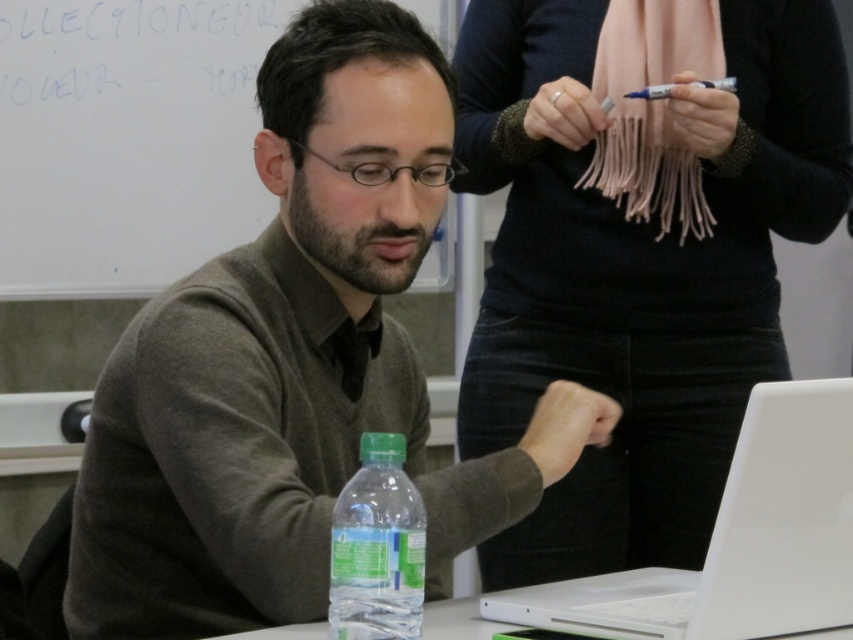
Question: Which of these objects is positioned closest to the matte gray sweater at center?

Choices:
 (A) whiteboard at upper left
 (B) white glossy laptop at lower right
 (C) metallic silver pen at upper right
 (D) pink fabric scarf at upper center

Answer: (B)

Question: Estimate the real-world distances between objects in this image. Which object is farther from the matte gray sweater at center?

Choices:
 (A) metallic silver pen at upper right
 (B) pink fabric scarf at upper center

Answer: (A)

Question: Where is whiteboard at upper left located in relation to white glossy laptop at lower right in the image?

Choices:
 (A) below
 (B) above

Answer: (B)

Question: In this image, where is white glossy laptop at lower right located relative to translucent plastic water bottle at center?

Choices:
 (A) right
 (B) left

Answer: (A)

Question: Is white glossy laptop at lower right wider than metallic silver pen at upper right?

Choices:
 (A) no
 (B) yes

Answer: (B)

Question: Which point is closer to the camera?

Choices:
 (A) (693, 237)
 (B) (404, 560)
 (C) (664, 93)
 (D) (279, 337)

Answer: (B)